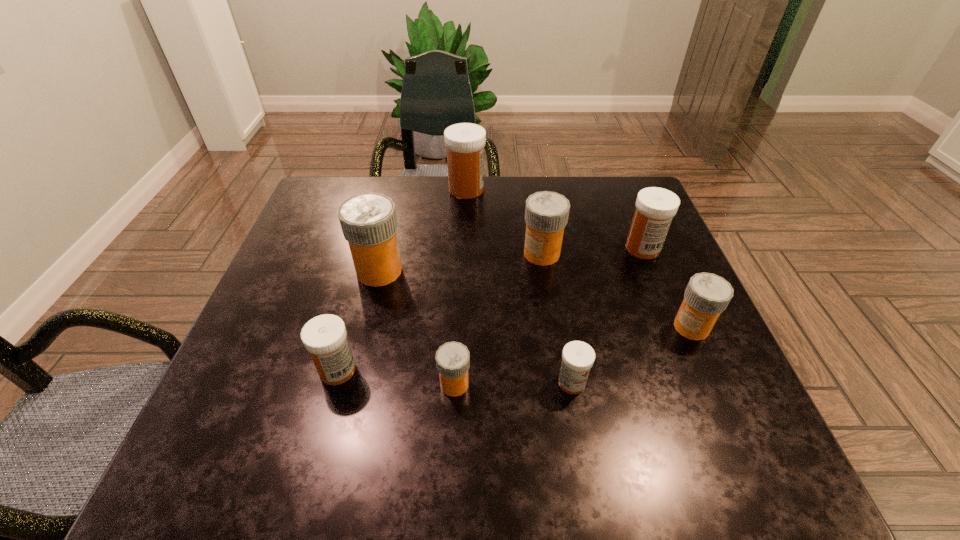
Where is `the smallest orange medicine`? The width and height of the screenshot is (960, 540). the smallest orange medicine is located at coordinates (452, 359).

Identify the location of the second white medicine from right to left. The width and height of the screenshot is (960, 540). point(578,357).

Where is `free location located 0.060m on the right of the farthest object`? The height and width of the screenshot is (540, 960). free location located 0.060m on the right of the farthest object is located at coordinates (506, 190).

The height and width of the screenshot is (540, 960). I want to click on vacant area located on the label side of the leftmost orange medicine, so click(564, 271).

The image size is (960, 540). Find the location of `free space located 0.080m on the left of the third nearest white medicine`. free space located 0.080m on the left of the third nearest white medicine is located at coordinates (592, 248).

Where is `vacant space situated 0.180m on the label side of the third orange medicine from left to right`? The width and height of the screenshot is (960, 540). vacant space situated 0.180m on the label side of the third orange medicine from left to right is located at coordinates (449, 254).

Where is `blank space located on the label side of the third orange medicine from left to right`? This screenshot has height=540, width=960. blank space located on the label side of the third orange medicine from left to right is located at coordinates (393, 254).

At what (x,y) coordinates should I click in order to perform the action: click on free space located on the label side of the third orange medicine from left to right. Please return your answer as a coordinate pair (x, y). The width and height of the screenshot is (960, 540). Looking at the image, I should click on tap(385, 254).

Where is `vacant space situated 0.180m on the label side of the fifth farthest object`? vacant space situated 0.180m on the label side of the fifth farthest object is located at coordinates (587, 327).

Locate an element on the screen. Image resolution: width=960 pixels, height=540 pixels. blank space located 0.160m on the label side of the fifth farthest object is located at coordinates (596, 327).